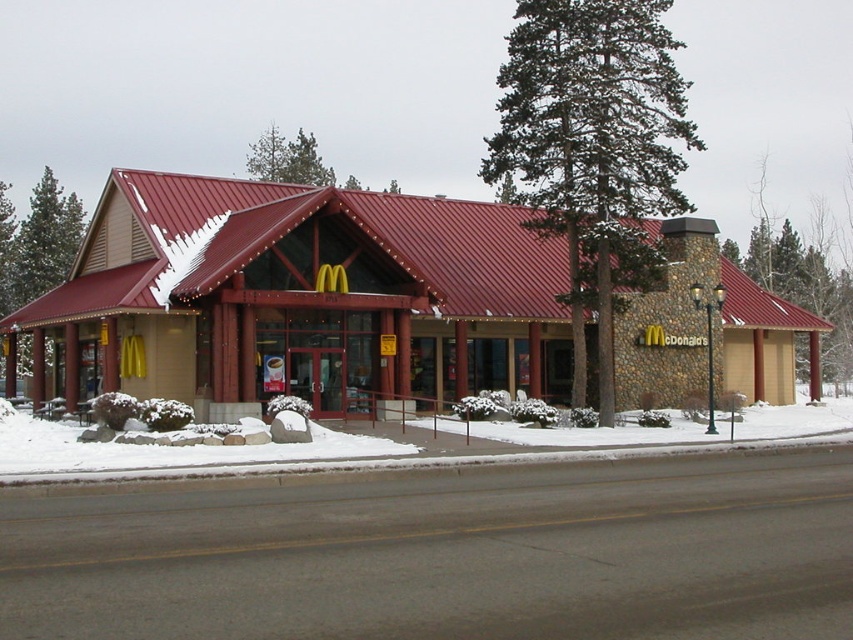
Question: Can you confirm if green textured tree at right is positioned to the right of green leafy tree at left?

Choices:
 (A) yes
 (B) no

Answer: (A)

Question: Does green coniferous tree at center have a larger size compared to green textured tree at right?

Choices:
 (A) no
 (B) yes

Answer: (B)

Question: Which object is farther from the camera taking this photo?

Choices:
 (A) green leafy tree at left
 (B) green textured tree at right
 (C) green coniferous tree at center

Answer: (A)

Question: Which point appears farthest from the camera in this image?

Choices:
 (A) coord(4,220)
 (B) coord(575,108)
 (C) coord(851,172)

Answer: (C)

Question: Can you confirm if green coniferous tree at center is bigger than green leafy tree at left?

Choices:
 (A) no
 (B) yes

Answer: (B)

Question: Which is farther from the green coniferous tree at center?

Choices:
 (A) green leafy tree at left
 (B) green textured tree at right

Answer: (A)